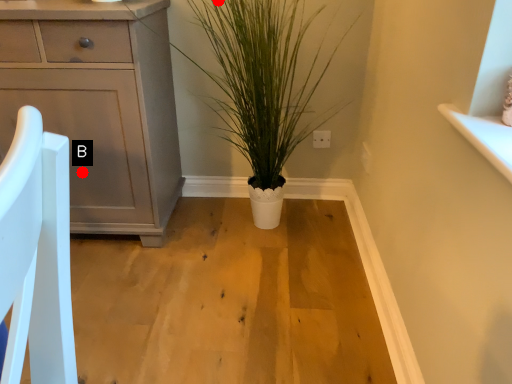
Question: Two points are circled on the image, labeled by A and B beside each circle. Among these points, which one is nearest to the camera?

Choices:
 (A) A is closer
 (B) B is closer

Answer: (B)